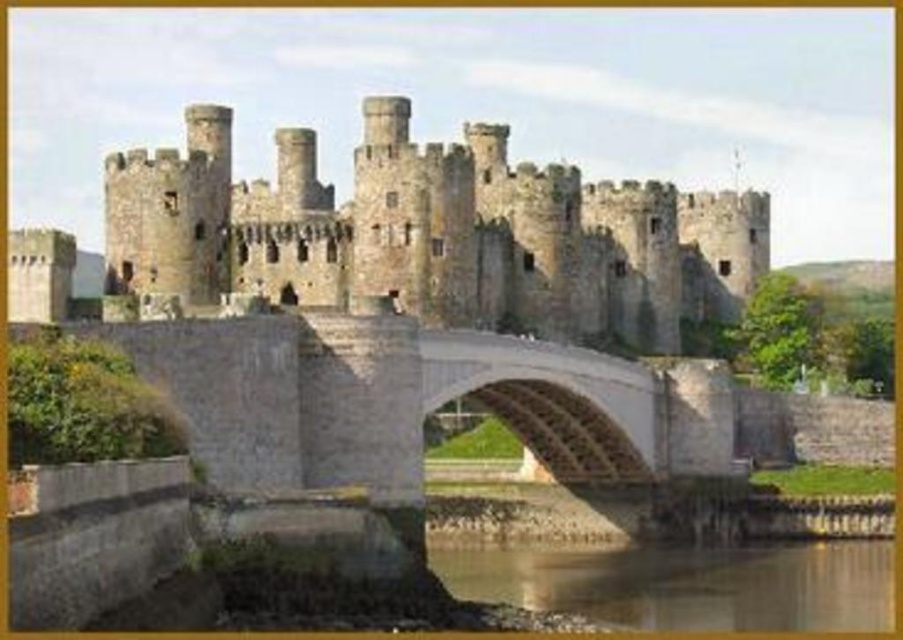
You are standing at the base of the castle looking towards the stone bridge. There are two points marked on the bridge structure. One is at coordinates point (715, 385) and the other at point (454, 580). Which point is closer to you?

Point (715, 385) is closer to you because it is further to the viewer than point (454, 580).

You are a medieval knight approaching the castle and must cross the bridge. The stone bridge at center and reflective glass water at lower center are in your path. Which one is larger in size?

The stone bridge at center is bigger than reflective glass water at lower center, so the stone bridge at center is larger in size.